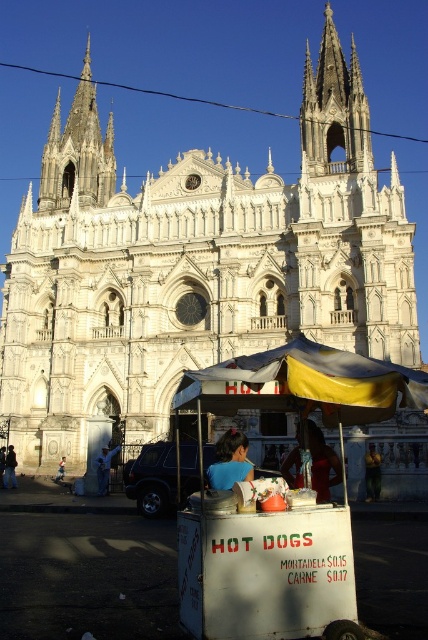
Question: Is red fabric umbrella at center behind dark blue jeans at lower left?

Choices:
 (A) yes
 (B) no

Answer: (B)

Question: Which point is farther from the camera taking this photo?

Choices:
 (A) [x=308, y=76]
 (B) [x=369, y=470]

Answer: (A)

Question: Can you confirm if dark brown hair at lower center is positioned above light brown wooden chair at lower left?

Choices:
 (A) no
 (B) yes

Answer: (B)

Question: Can you confirm if white stone spire at upper left is positioned to the right of light blue fabric at lower left?

Choices:
 (A) no
 (B) yes

Answer: (A)

Question: Estimate the real-world distances between objects in this image. Which object is closer to the light brown wooden chair at lower left?

Choices:
 (A) red fabric umbrella at center
 (B) dark blue jeans at lower left

Answer: (B)

Question: Among these points, which one is nearest to the camera?

Choices:
 (A) (6, 461)
 (B) (62, 474)
 (C) (106, 468)

Answer: (C)